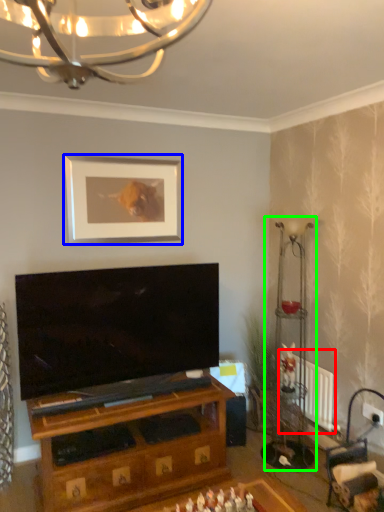
Question: Considering the real-world distances, which object is closest to radiator (highlighted by a red box)? picture frame (highlighted by a blue box) or lamp (highlighted by a green box).

Choices:
 (A) picture frame
 (B) lamp

Answer: (B)